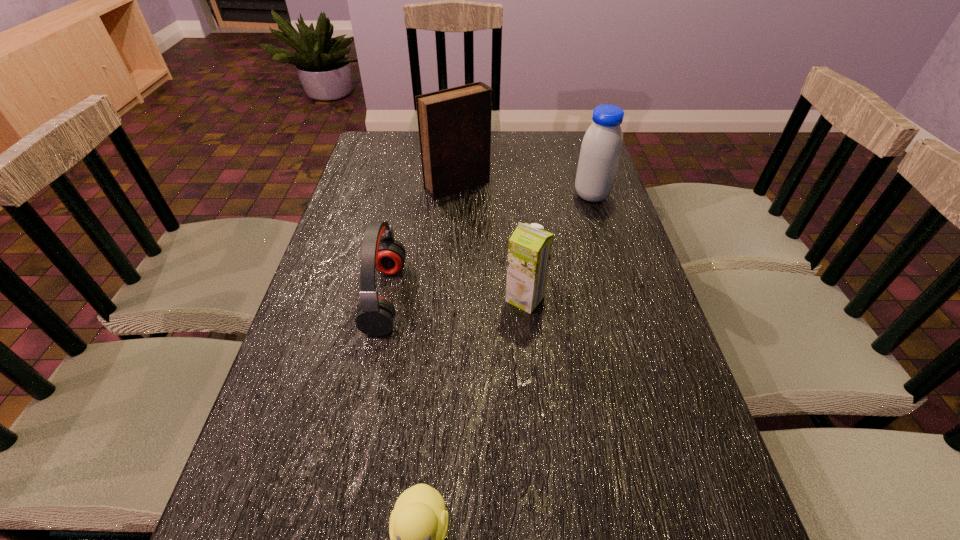
In order to click on object that stands as the third closest to the duckling in this screenshot , I will do `click(454, 124)`.

Locate which object ranks in proximity to the nearer soya milk. Please provide its 2D coordinates. Your answer should be formatted as a tuple, i.e. [(x, y)], where the tuple contains the x and y coordinates of a point satisfying the conditions above.

[(375, 317)]

Identify the location of vacant space that satisfies the following two spatial constraints: 1. on the front side of the Bible; 2. on the ear cups of the leftmost object. This screenshot has width=960, height=540. (450, 298).